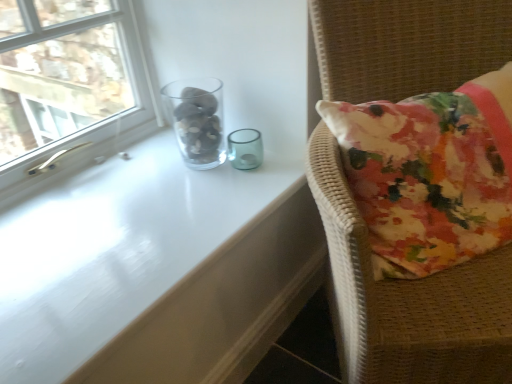
This screenshot has height=384, width=512. What are the coordinates of `vacant area located to the right-hand side of transparent glass vase at upper left` in the screenshot? It's located at coord(257,166).